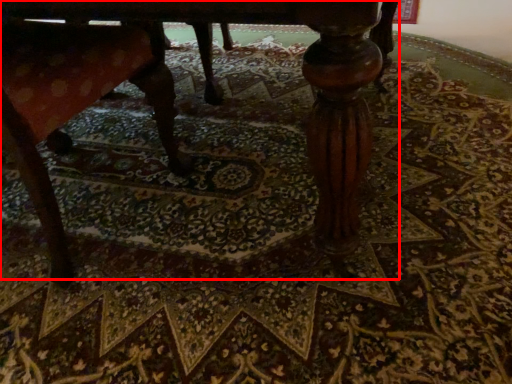
Question: From the image's perspective, where is table (annotated by the red box) located in relation to rocking chair in the image?

Choices:
 (A) above
 (B) below

Answer: (A)